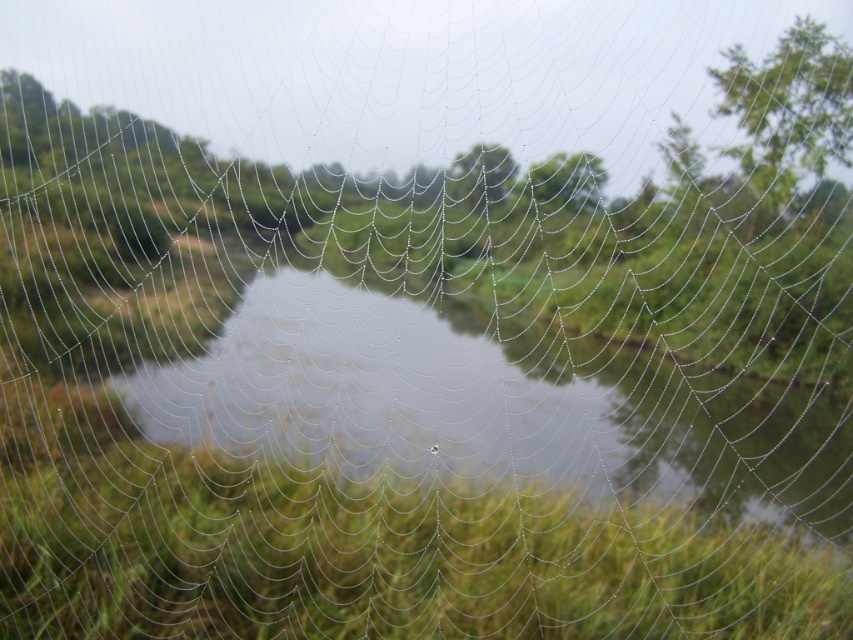
Who is more distant from viewer, (727, 413) or (543, 164)?

Positioned behind is point (543, 164).

Who is positioned more to the left, transparent water at center or green leafy tree at upper center?

Positioned to the left is transparent water at center.

Is point (431, 330) positioned behind point (537, 202)?

That is False.

The image size is (853, 640). I want to click on transparent water at center, so click(x=492, y=403).

Can you confirm if transparent water at center is thinner than green leafy tree at center?

In fact, transparent water at center might be wider than green leafy tree at center.

What do you see at coordinates (492, 403) in the screenshot?
I see `transparent water at center` at bounding box center [492, 403].

You are a GUI agent. You are given a task and a screenshot of the screen. Output one action in this format:
    pyautogui.click(x=<x>, y=<y>)
    Task: Click on the transparent water at center
    Image resolution: width=853 pixels, height=640 pixels.
    Given the screenshot: What is the action you would take?
    pyautogui.click(x=492, y=403)

Does green leafy tree at upper right appear on the right side of green leafy tree at center?

Indeed, green leafy tree at upper right is positioned on the right side of green leafy tree at center.

Is point (727, 70) closer to viewer compared to point (506, 173)?

No, (727, 70) is behind (506, 173).

You are a GUI agent. You are given a task and a screenshot of the screen. Output one action in this format:
    pyautogui.click(x=<x>, y=<y>)
    Task: Click on the green leafy tree at upper right
    
    Given the screenshot: What is the action you would take?
    pyautogui.click(x=788, y=109)